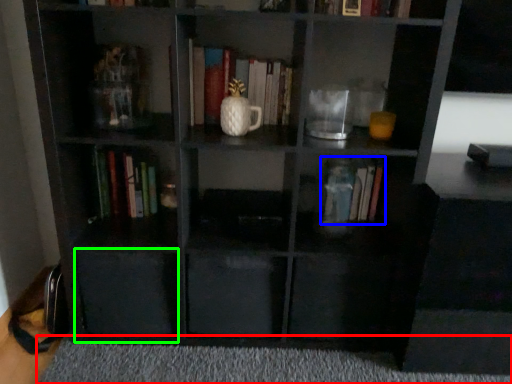
Question: Based on their relative distances, which object is farther from plain (highlighted by a red box)? Choose from book (highlighted by a blue box) and drawer (highlighted by a green box).

Choices:
 (A) book
 (B) drawer

Answer: (A)